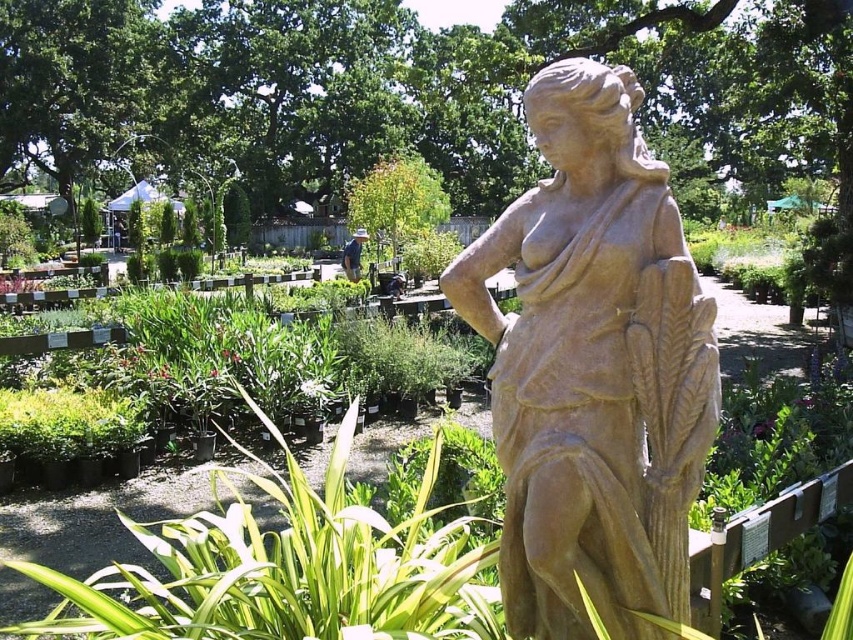
Question: Is matte stone statue at center wider than green leafy plant at center?

Choices:
 (A) yes
 (B) no

Answer: (B)

Question: Which object appears farthest from the camera in this image?

Choices:
 (A) green leafy plant at center
 (B) matte stone statue at center

Answer: (A)

Question: Which object is farther from the camera taking this photo?

Choices:
 (A) matte stone statue at center
 (B) green leafy plant at center

Answer: (B)

Question: Which point is farther to the camera?

Choices:
 (A) matte stone statue at center
 (B) green leafy plant at center

Answer: (B)

Question: Is matte stone statue at center further to camera compared to green leafy plant at center?

Choices:
 (A) yes
 (B) no

Answer: (B)

Question: Can you confirm if matte stone statue at center is smaller than green leafy plant at center?

Choices:
 (A) no
 (B) yes

Answer: (B)